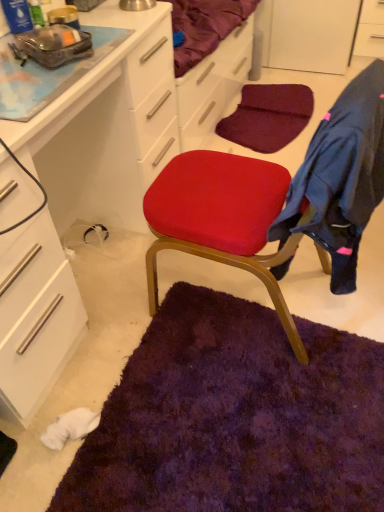
Consider the image. Measure the distance between dark blue fleece jacket at right and camera.

A distance of 32.22 inches exists between dark blue fleece jacket at right and camera.

Identify the location of matte white cabinet at center, placed as the 1th cabinetry when sorted from left to right. Image resolution: width=384 pixels, height=512 pixels. (82, 192).

The image size is (384, 512). I want to click on dark blue fleece jacket at right, so click(x=341, y=177).

Which is more to the left, matte white cabinet at center, which is the first cabinetry in bottom-to-top order, or white glossy cabinet at upper right, which ranks as the first cabinetry in right-to-left order?

Positioned to the left is matte white cabinet at center, which is the first cabinetry in bottom-to-top order.

Would you say matte white cabinet at center, the 1th cabinetry positioned from the front, is a long distance from white glossy cabinet at upper right, which appears as the first cabinetry when viewed from the back?

That's right, there is a large distance between matte white cabinet at center, the 1th cabinetry positioned from the front, and white glossy cabinet at upper right, which appears as the first cabinetry when viewed from the back.

Between matte white cabinet at center, which ranks as the 2th cabinetry in right-to-left order, and white glossy cabinet at upper right, which ranks as the first cabinetry in right-to-left order, which one has larger size?

matte white cabinet at center, which ranks as the 2th cabinetry in right-to-left order, is bigger.

Which object is closer to the camera taking this photo, matte white cabinet at center, which is counted as the 2th cabinetry, starting from the back, or dark blue fleece jacket at right?

matte white cabinet at center, which is counted as the 2th cabinetry, starting from the back.

From a real-world perspective, is matte white cabinet at center, which ranks as the 2th cabinetry in right-to-left order, physically above dark blue fleece jacket at right?

No, from a real-world perspective, matte white cabinet at center, which ranks as the 2th cabinetry in right-to-left order, is not on top of dark blue fleece jacket at right.

Is white glossy cabinet at upper right, which ranks as the first cabinetry in right-to-left order, not near matte white cabinet at center, which ranks as the 2th cabinetry in right-to-left order?

Yes, white glossy cabinet at upper right, which ranks as the first cabinetry in right-to-left order, is far from matte white cabinet at center, which ranks as the 2th cabinetry in right-to-left order.

Is white glossy cabinet at upper right, acting as the 2th cabinetry starting from the bottom, smaller than matte white cabinet at center, the 1th cabinetry positioned from the front?

Yes.

Looking at this image, relative to matte white cabinet at center, which is counted as the 2th cabinetry, starting from the back, is white glossy cabinet at upper right, which ranks as the 2th cabinetry in left-to-right order, in front or behind?

Clearly, white glossy cabinet at upper right, which ranks as the 2th cabinetry in left-to-right order, is behind matte white cabinet at center, which is counted as the 2th cabinetry, starting from the back.

Which object is wider, white glossy cabinet at upper right, the 2th cabinetry viewed from the front, or matte white cabinet at center, the 2th cabinetry viewed from the top?

matte white cabinet at center, the 2th cabinetry viewed from the top, is wider.

You are a GUI agent. You are given a task and a screenshot of the screen. Output one action in this format:
    pyautogui.click(x=<x>, y=<y>)
    Task: Click on the cabinetry on the left of dark blue fleece jacket at right
    Image resolution: width=384 pixels, height=512 pixels.
    Given the screenshot: What is the action you would take?
    pyautogui.click(x=82, y=192)

Which of these two, dark blue fleece jacket at right or matte white cabinet at center, placed as the 1th cabinetry when sorted from left to right, is wider?

matte white cabinet at center, placed as the 1th cabinetry when sorted from left to right, is wider.

From the image's perspective, between dark blue fleece jacket at right and matte white cabinet at center, the 2th cabinetry viewed from the top, who is located below?

dark blue fleece jacket at right, from the image's perspective.

Is dark blue fleece jacket at right in contact with matte white cabinet at center, the 1th cabinetry positioned from the front?

No, dark blue fleece jacket at right is not making contact with matte white cabinet at center, the 1th cabinetry positioned from the front.

Locate an element on the screen. The height and width of the screenshot is (512, 384). clothing on the left of white glossy cabinet at upper right, which ranks as the 2th cabinetry in left-to-right order is located at coordinates (341, 177).

From the image's perspective, would you say white glossy cabinet at upper right, which appears as the first cabinetry when viewed from the back, is positioned over dark blue fleece jacket at right?

Yes, from the image's perspective, white glossy cabinet at upper right, which appears as the first cabinetry when viewed from the back, is over dark blue fleece jacket at right.

Is white glossy cabinet at upper right, the 2th cabinetry viewed from the front, spatially inside dark blue fleece jacket at right, or outside of it?

white glossy cabinet at upper right, the 2th cabinetry viewed from the front, is outside dark blue fleece jacket at right.

Can you see dark blue fleece jacket at right touching white glossy cabinet at upper right, which appears as the first cabinetry when viewed from the back?

No, dark blue fleece jacket at right is not with white glossy cabinet at upper right, which appears as the first cabinetry when viewed from the back.

From the image's perspective, is dark blue fleece jacket at right over white glossy cabinet at upper right, placed as the first cabinetry when sorted from top to bottom?

No, from the image's perspective, dark blue fleece jacket at right is not over white glossy cabinet at upper right, placed as the first cabinetry when sorted from top to bottom.

In the scene shown: From a real-world perspective, is dark blue fleece jacket at right on white glossy cabinet at upper right, placed as the first cabinetry when sorted from top to bottom?

Yes, from a real-world perspective, dark blue fleece jacket at right is over white glossy cabinet at upper right, placed as the first cabinetry when sorted from top to bottom

Image resolution: width=384 pixels, height=512 pixels. Identify the location of cabinetry on the right of matte white cabinet at center, which is the first cabinetry in bottom-to-top order. (370, 30).

The height and width of the screenshot is (512, 384). Find the location of `cabinetry in front of the dark blue fleece jacket at right`. cabinetry in front of the dark blue fleece jacket at right is located at coordinates (82, 192).

Looking at the image, which one is located closer to dark blue fleece jacket at right, matte white cabinet at center, which is the first cabinetry in bottom-to-top order, or white glossy cabinet at upper right, acting as the 2th cabinetry starting from the bottom?

matte white cabinet at center, which is the first cabinetry in bottom-to-top order.

Based on the photo, considering their positions, is matte white cabinet at center, placed as the 1th cabinetry when sorted from left to right, positioned closer to white glossy cabinet at upper right, which appears as the first cabinetry when viewed from the back, than dark blue fleece jacket at right?

matte white cabinet at center, placed as the 1th cabinetry when sorted from left to right.

Based on their spatial positions, is white glossy cabinet at upper right, the 2th cabinetry viewed from the front, or dark blue fleece jacket at right further from matte white cabinet at center, which is counted as the 2th cabinetry, starting from the back?

white glossy cabinet at upper right, the 2th cabinetry viewed from the front, is further to matte white cabinet at center, which is counted as the 2th cabinetry, starting from the back.

Estimate the real-world distances between objects in this image. Which object is further from matte white cabinet at center, the 1th cabinetry positioned from the front, dark blue fleece jacket at right or white glossy cabinet at upper right, which appears as the first cabinetry when viewed from the back?

The object further to matte white cabinet at center, the 1th cabinetry positioned from the front, is white glossy cabinet at upper right, which appears as the first cabinetry when viewed from the back.

Consider the image. Which object lies nearer to the anchor point dark blue fleece jacket at right, white glossy cabinet at upper right, which ranks as the 2th cabinetry in left-to-right order, or matte white cabinet at center, the 1th cabinetry positioned from the front?

matte white cabinet at center, the 1th cabinetry positioned from the front.

From the image, which object appears to be nearer to white glossy cabinet at upper right, which ranks as the 2th cabinetry in left-to-right order, dark blue fleece jacket at right or matte white cabinet at center, which is the first cabinetry in bottom-to-top order?

matte white cabinet at center, which is the first cabinetry in bottom-to-top order, lies closer to white glossy cabinet at upper right, which ranks as the 2th cabinetry in left-to-right order, than the other object.

The height and width of the screenshot is (512, 384). I want to click on clothing between matte white cabinet at center, which is counted as the 2th cabinetry, starting from the back, and white glossy cabinet at upper right, which appears as the first cabinetry when viewed from the back, along the z-axis, so click(x=341, y=177).